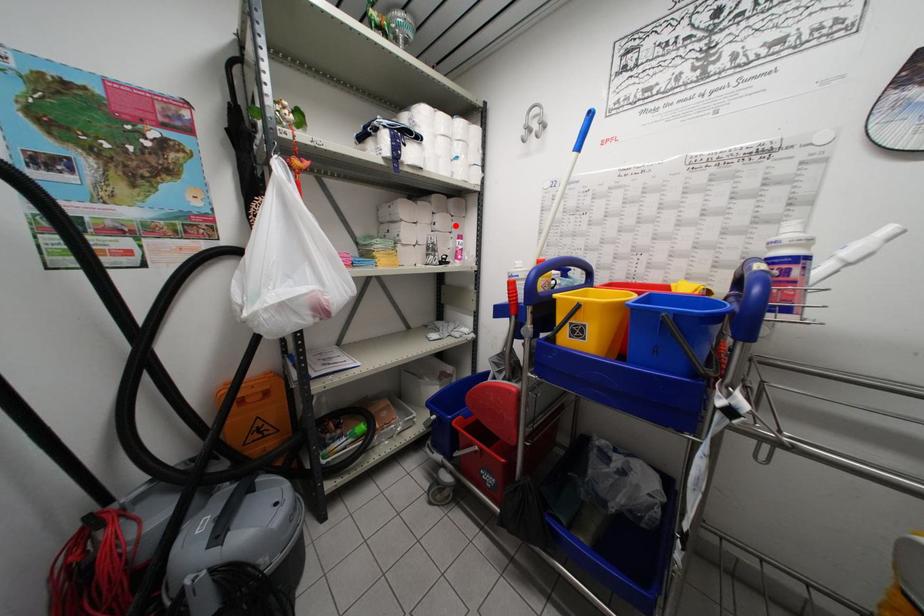
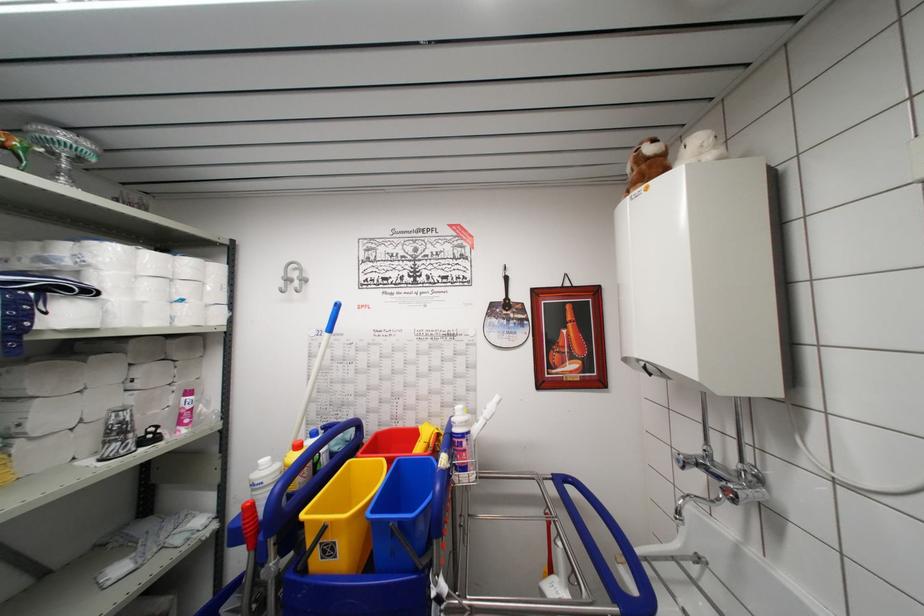
Question: I am providing you with two images of the same scene from different viewpoints. Image1 has a red point marked. In image2, the corresponding 3D location appears at what relative position? Reply with the corresponding letter.

Choices:
 (A) Closer
 (B) Farther

Answer: (B)